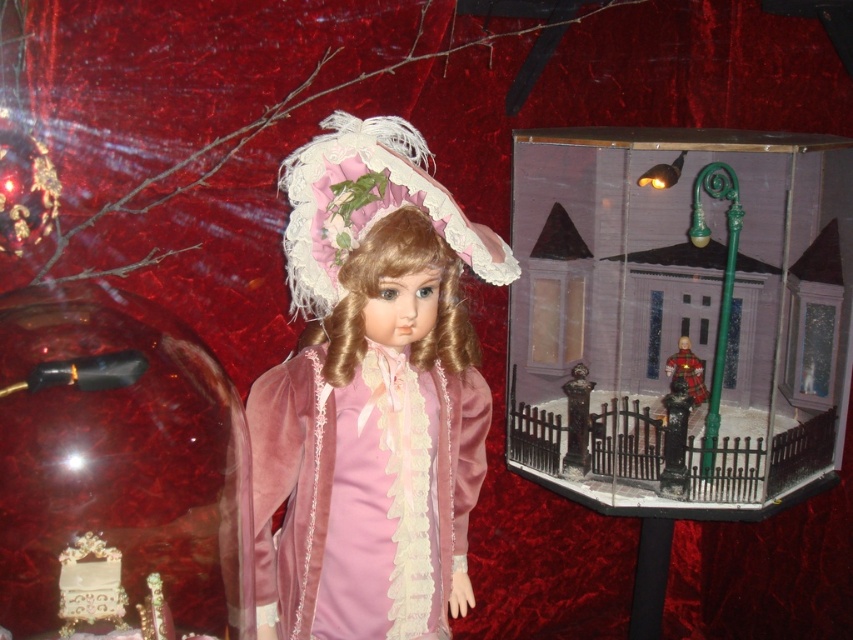
Question: In this image, where is transparent plastic diorama at right located relative to velvet pink doll at center?

Choices:
 (A) below
 (B) above

Answer: (B)

Question: Can you confirm if transparent plastic diorama at right is wider than velvet pink doll at center?

Choices:
 (A) yes
 (B) no

Answer: (A)

Question: Which of the following is the farthest from the observer?

Choices:
 (A) transparent plastic diorama at right
 (B) velvet pink doll at center

Answer: (A)

Question: Which point is farther from the camera taking this photo?

Choices:
 (A) (703, 477)
 (B) (383, 541)

Answer: (A)

Question: Does transparent plastic diorama at right have a larger size compared to velvet pink doll at center?

Choices:
 (A) yes
 (B) no

Answer: (A)